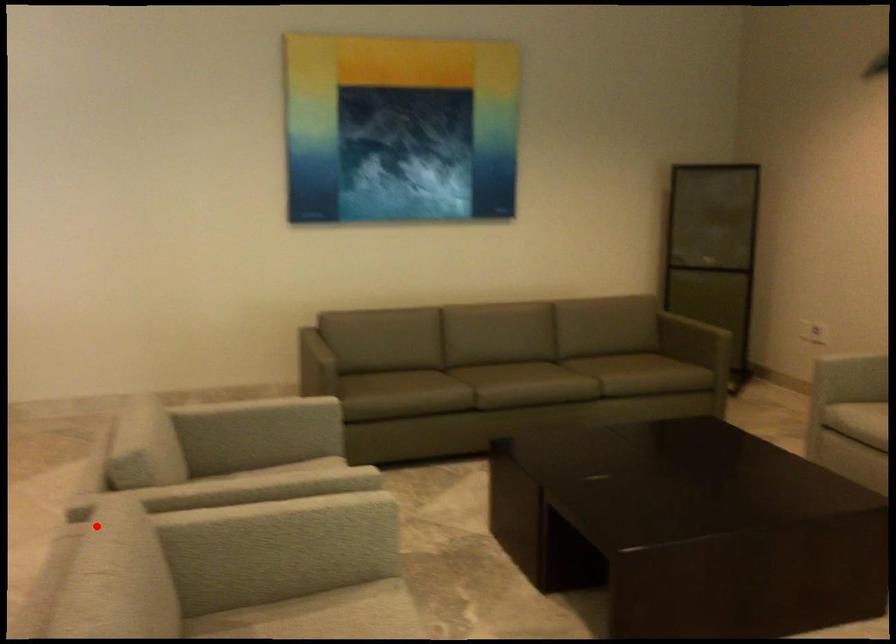
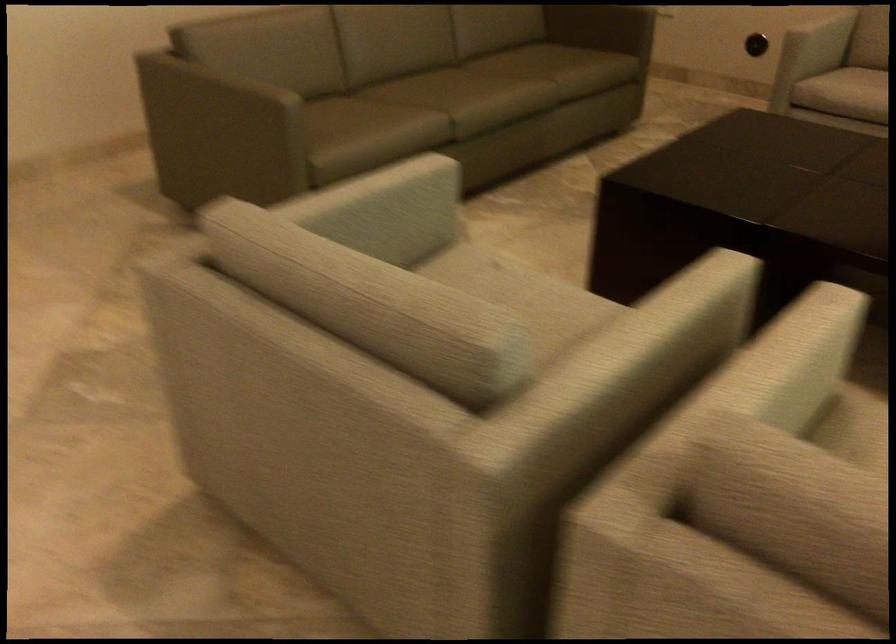
Where in the second image is the point corresponding to the highlighted location from the first image?

(806, 468)